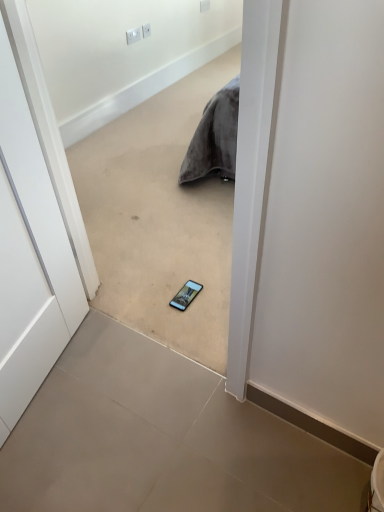
Question: From the image's perspective, is white matte door at center above or below gray tile floor at center, placed as the second concrete when sorted from bottom to top?

Choices:
 (A) below
 (B) above

Answer: (A)

Question: Visually, is white matte door at center positioned to the left or to the right of gray tile floor at center, placed as the second concrete when sorted from bottom to top?

Choices:
 (A) right
 (B) left

Answer: (B)

Question: Based on their relative distances, which object is farther from the gray tile floor at center, placed as the second concrete when sorted from bottom to top?

Choices:
 (A) matte black smartphone at center
 (B) white plastic electric outlet at upper center, which is the first electric outlet in right-to-left order
 (C) gray tile floor at center, positioned as the first concrete in bottom-to-top order
 (D) white plastic electric outlet at upper center, acting as the third electric outlet starting from the back
 (E) white matte door at center

Answer: (B)

Question: Which object is positioned closest to the white matte door at center?

Choices:
 (A) matte black smartphone at center
 (B) gray tile floor at center, placed as the second concrete when sorted from bottom to top
 (C) white plastic electric outlet at upper center, which is counted as the 2th electric outlet, starting from the top
 (D) white plastic electric outlet at upper center, which is counted as the 3th electric outlet, starting from the front
 (E) gray tile floor at center, positioned as the first concrete in bottom-to-top order

Answer: (E)